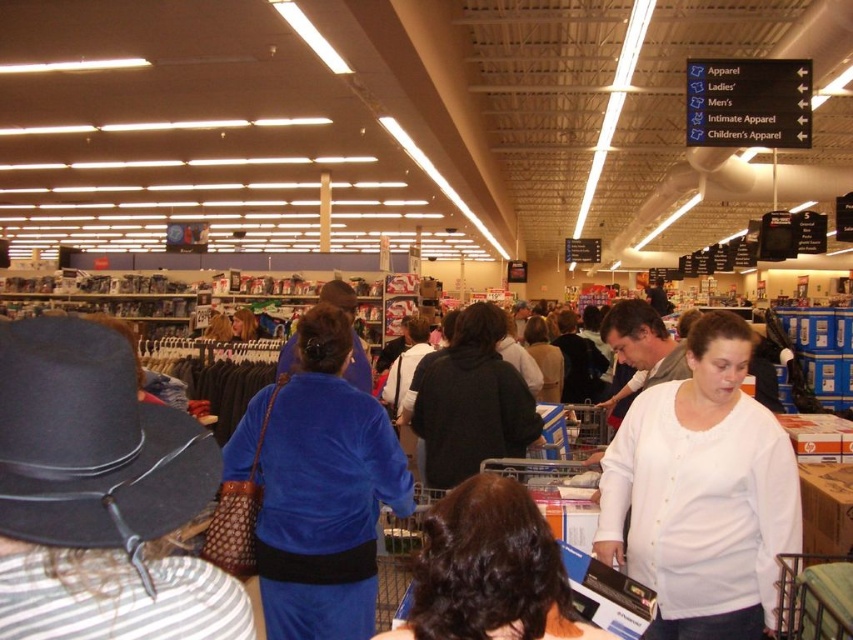
You are a store employee who needs to arrange a display between the velvet blue dress at center and the brown curly hair at center. Which object requires more horizontal space for the display?

The velvet blue dress at center requires more horizontal space because its width surpasses that of the brown curly hair at center.

You are a customer in the store and want to find the velvet blue dress at center. Where should you look relative to the brown curly hair at center?

The velvet blue dress at center is located below the brown curly hair at center, so you should look downward from the brown curly hair at center to find it.